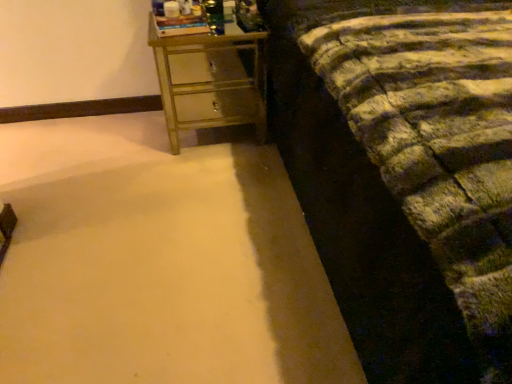
The width and height of the screenshot is (512, 384). I want to click on free space in front of gold metallic chest of drawers at upper left, so click(x=194, y=182).